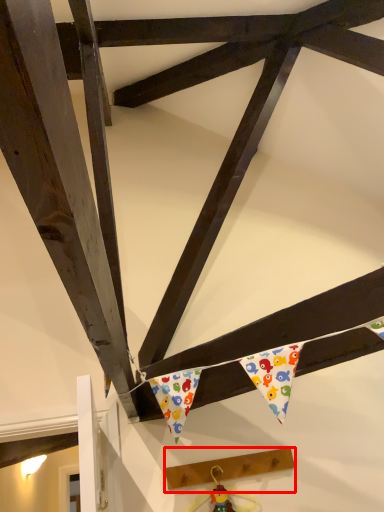
Question: From the image's perspective, what is the correct spatial relationship of plank (annotated by the red box) in relation to toy?

Choices:
 (A) above
 (B) below

Answer: (A)